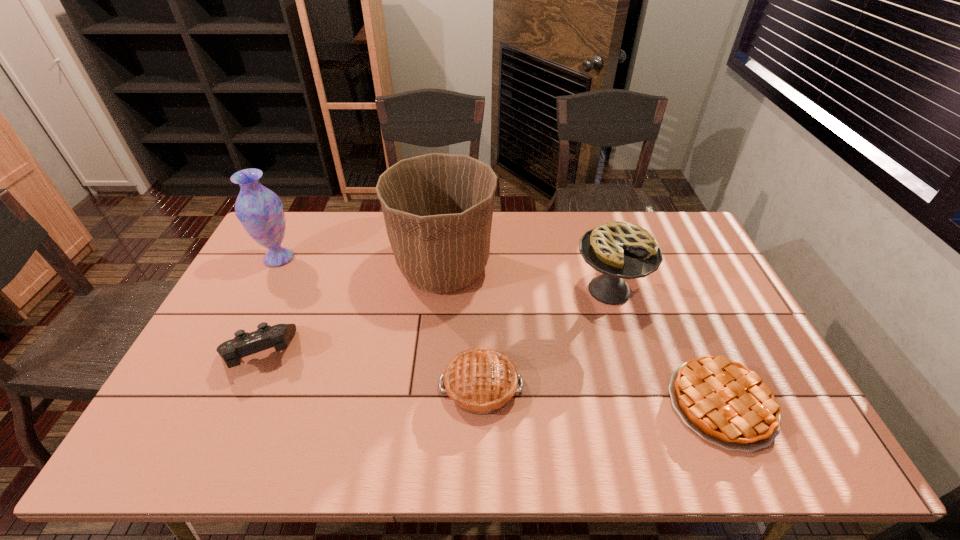
The width and height of the screenshot is (960, 540). I want to click on object present at the far left corner, so click(260, 211).

At what (x,y) coordinates should I click in order to perform the action: click on object at the near right corner. Please return your answer as a coordinate pair (x, y). The image size is (960, 540). Looking at the image, I should click on (725, 403).

In the image, there is a desktop. Identify the location of free space at the far edge. (513, 212).

Find the location of a particular element. free point at the near edge is located at coordinates (641, 428).

Image resolution: width=960 pixels, height=540 pixels. In order to click on vacant space at the left edge in this screenshot , I will do `click(270, 293)`.

Locate an element on the screen. This screenshot has height=540, width=960. blank space at the right edge is located at coordinates (780, 393).

Image resolution: width=960 pixels, height=540 pixels. In the image, there is a desktop. Identify the location of free space at the far left corner. (288, 231).

Where is `vacant region at the near left corner of the desktop`? This screenshot has width=960, height=540. vacant region at the near left corner of the desktop is located at coordinates (154, 451).

Locate an element on the screen. Image resolution: width=960 pixels, height=540 pixels. free location at the far right corner of the desktop is located at coordinates (663, 217).

Locate an element on the screen. The image size is (960, 540). vacant area at the near right corner of the desktop is located at coordinates (805, 436).